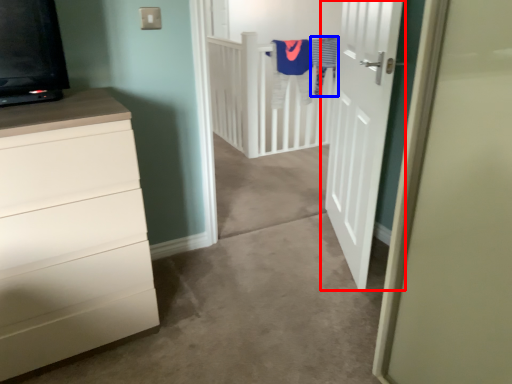
Question: Which object is further to the camera taking this photo, door (highlighted by a red box) or laundry (highlighted by a blue box)?

Choices:
 (A) door
 (B) laundry

Answer: (B)